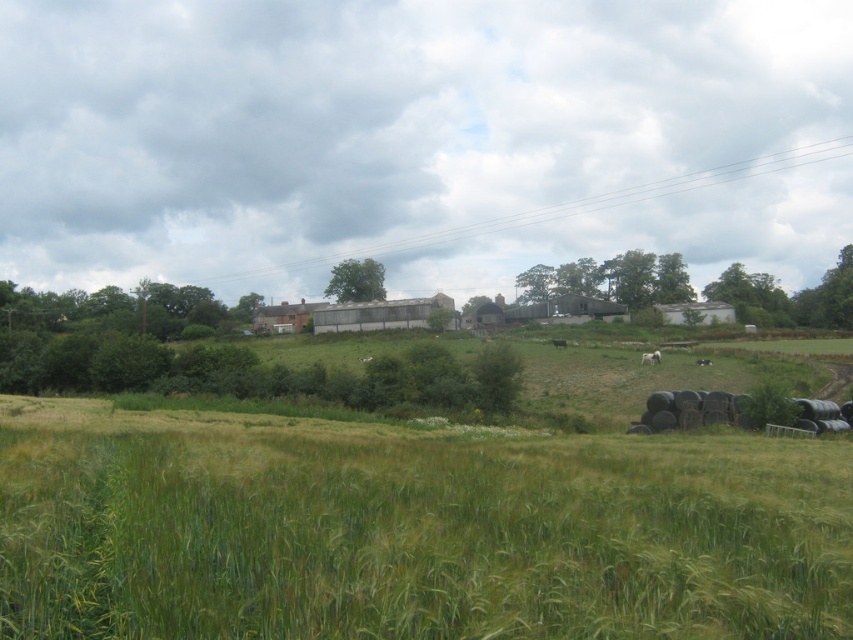
Measure the distance between white woolly sheep at center and camera.

white woolly sheep at center is 80.99 meters away from camera.

Does white woolly sheep at center appear over white fluffy sheep at lower right?

Correct, white woolly sheep at center is located above white fluffy sheep at lower right.

Who is more forward, (650, 356) or (706, 364)?

Point (706, 364) is more forward.

You are a GUI agent. You are given a task and a screenshot of the screen. Output one action in this format:
    pyautogui.click(x=<x>, y=<y>)
    Task: Click on the white woolly sheep at center
    This screenshot has width=853, height=640.
    Given the screenshot: What is the action you would take?
    pyautogui.click(x=651, y=356)

Is green grassy wheat field at lower center positioned at the back of white fluffy sheep at lower right?

No, green grassy wheat field at lower center is in front of white fluffy sheep at lower right.

This screenshot has width=853, height=640. Find the location of `green grassy wheat field at lower center`. green grassy wheat field at lower center is located at coordinates (410, 531).

Measure the distance from green grassy wheat field at lower center to white woolly sheep at center.

The distance of green grassy wheat field at lower center from white woolly sheep at center is 192.81 feet.

Which of these two, green grassy wheat field at lower center or white woolly sheep at center, stands taller?

With more height is green grassy wheat field at lower center.

Is point (515, 438) positioned behind point (656, 349)?

No, it is not.

Find the location of `green grassy wheat field at lower center`. green grassy wheat field at lower center is located at coordinates (410, 531).